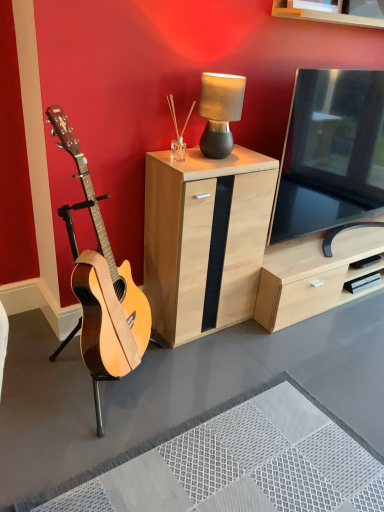
Locate an element on the screen. unoccupied region to the right of natural wood guitar at left is located at coordinates (213, 386).